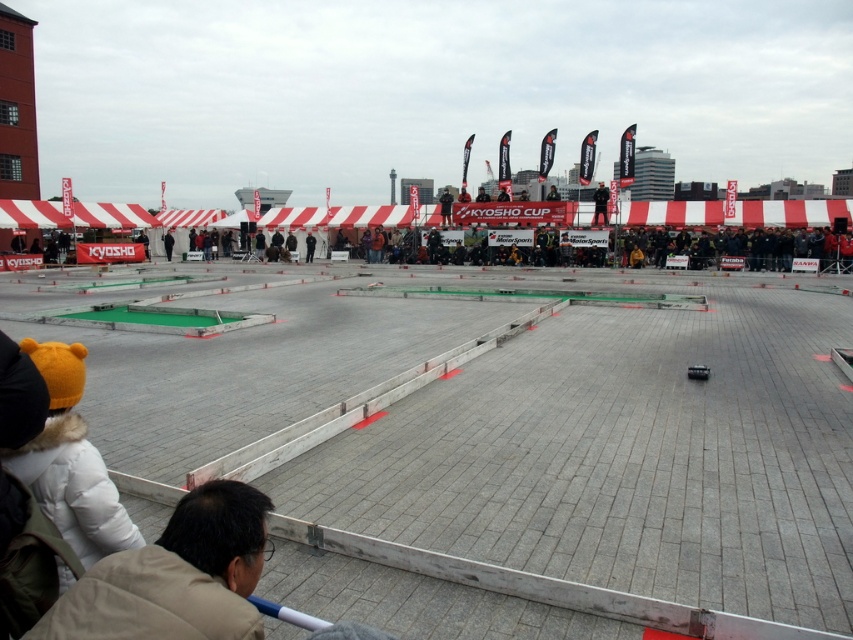
Looking at this image, is white fur-lined coat at lower left to the left of dark gray jacket at center from the viewer's perspective?

Correct, you'll find white fur-lined coat at lower left to the left of dark gray jacket at center.

Measure the distance between point [57,394] and camera.

A distance of 2.42 meters exists between point [57,394] and camera.

Identify the location of white fur-lined coat at lower left. The image size is (853, 640). (70, 461).

Does point (74, 625) come closer to viewer compared to point (595, 212)?

That is True.

Is point (148, 634) positioned in front of point (601, 208)?

Yes, point (148, 634) is closer to viewer.

Locate an element on the screen. The height and width of the screenshot is (640, 853). beige fabric jacket at lower left is located at coordinates (175, 577).

What do you see at coordinates (625, 451) in the screenshot? I see `concrete gray race track at center` at bounding box center [625, 451].

In the scene shown: Is concrete gray race track at center to the left of beige fabric jacket at lower left from the viewer's perspective?

In fact, concrete gray race track at center is to the right of beige fabric jacket at lower left.

Describe the element at coordinates (625, 451) in the screenshot. I see `concrete gray race track at center` at that location.

Locate an element on the screen. Image resolution: width=853 pixels, height=640 pixels. concrete gray race track at center is located at coordinates (625, 451).